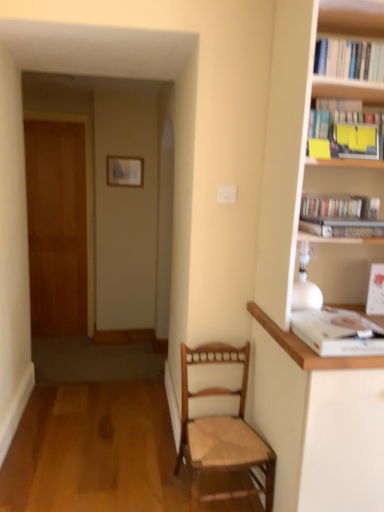
Question: Is wooden desk at right wider or thinner than hardcover book at upper right, marked as the 4th book in a top-to-bottom arrangement?

Choices:
 (A) thin
 (B) wide

Answer: (B)

Question: Is point (283, 384) closer or farther from the camera than point (349, 223)?

Choices:
 (A) closer
 (B) farther

Answer: (B)

Question: Which is farther from the hardcover books at upper right, the 3th book when ordered from top to bottom?

Choices:
 (A) white paper book at upper right, which is counted as the first book, starting from the bottom
 (B) wooden picture frame at upper center
 (C) hardcover book at upper right, marked as the 4th book in a top-to-bottom arrangement
 (D) wooden door at left
 (E) yellow paper at upper right, which appears as the fourth book when ordered from the bottom

Answer: (D)

Question: Based on their relative distances, which object is nearer to the wooden picture frame at upper center?

Choices:
 (A) white paperbacks at upper right, arranged as the first book when viewed from the top
 (B) hardcover book at upper right, marked as the 4th book in a top-to-bottom arrangement
 (C) wooden door at left
 (D) yellow paper at upper right, which appears as the fourth book when ordered from the bottom
 (E) light brown wood chair at lower center

Answer: (C)